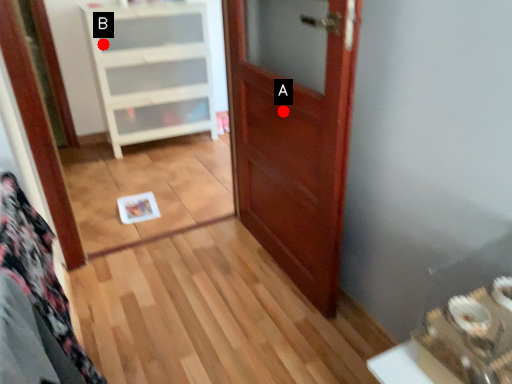
Question: Two points are circled on the image, labeled by A and B beside each circle. Which of the following is the farthest from the observer?

Choices:
 (A) A is further
 (B) B is further

Answer: (B)